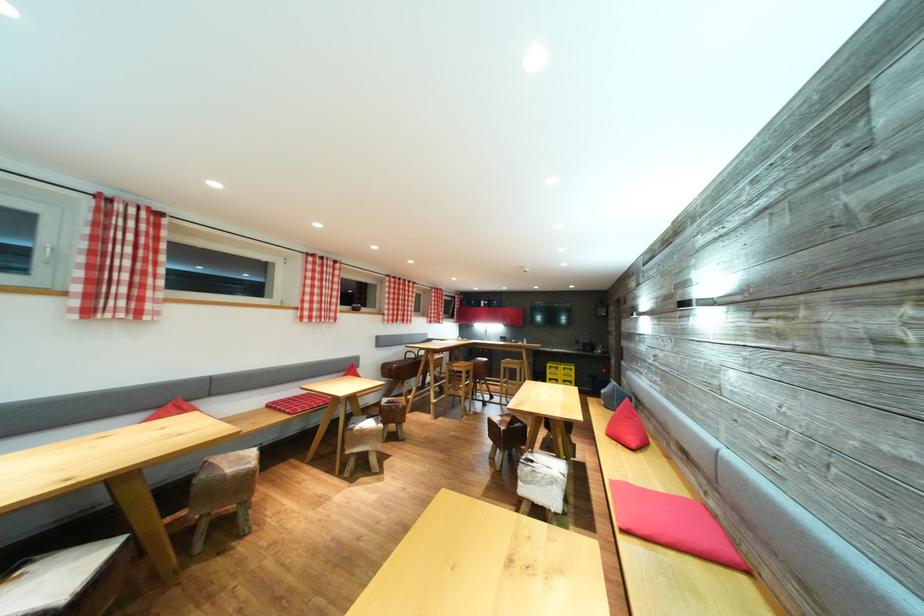
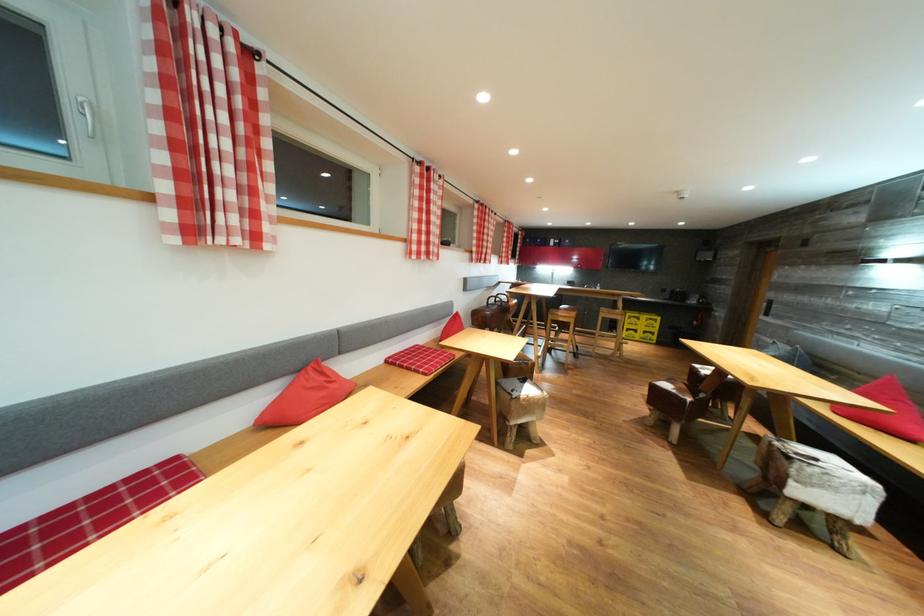
In the second image, find the point that corresponds to point 186,413 in the first image.

(330, 378)